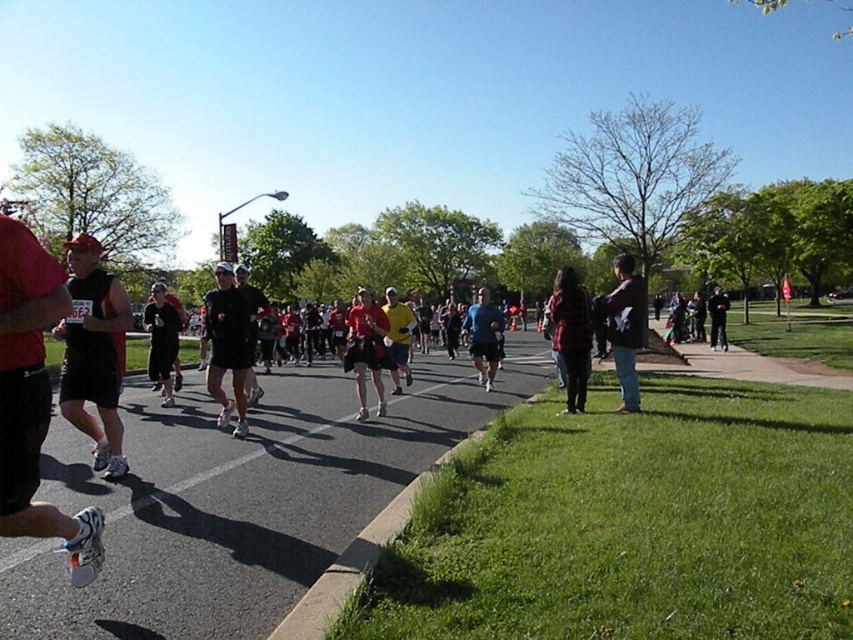
Measure the distance between point [160,301] and camera.

They are 11.15 meters apart.

Does dark gray fabric jacket at center have a greater height compared to black leather jacket at right?

No, dark gray fabric jacket at center is not taller than black leather jacket at right.

Image resolution: width=853 pixels, height=640 pixels. What are the coordinates of `dark gray fabric jacket at center` in the screenshot? It's located at (161, 340).

Does point (392, 323) lie behind point (714, 312)?

That is False.

Between yellow fabric shirt at center and black leather jacket at right, which one is positioned higher?

black leather jacket at right

Find the location of a particular element. yellow fabric shirt at center is located at coordinates (397, 339).

This screenshot has width=853, height=640. What are the coordinates of `yellow fabric shirt at center` in the screenshot? It's located at (397, 339).

Which is in front, point (209, 348) or point (399, 316)?

Point (399, 316) is more forward.

Who is lower down, black matte shorts at center or yellow fabric shirt at center?

black matte shorts at center is lower down.

Identify the location of black matte shorts at center. This screenshot has height=640, width=853. (228, 346).

The height and width of the screenshot is (640, 853). Identify the location of black matte shorts at center. (228, 346).